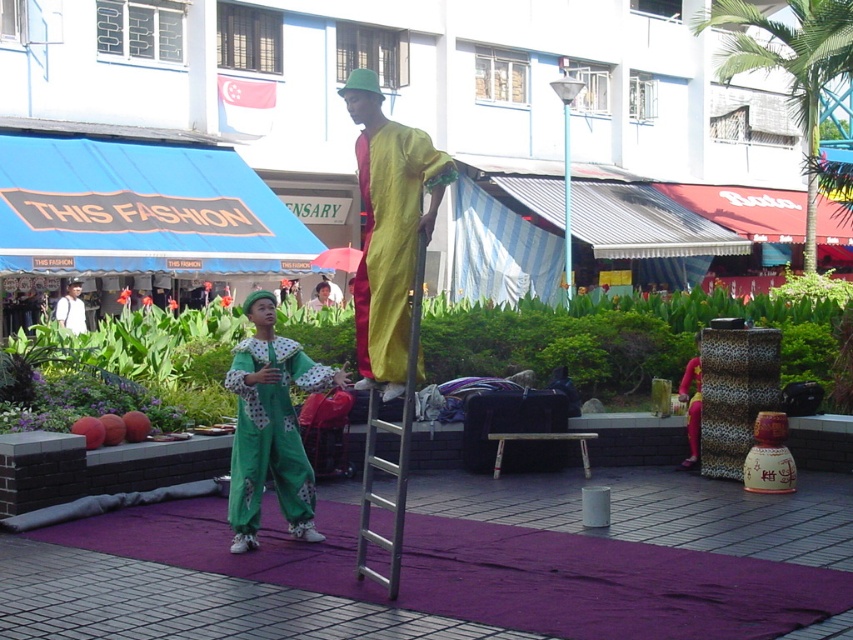
You are a photographer trying to capture the performers on the purple carpet. You notice two points marked in the scene. Which point, point (358, 257) or point (329, 305), is closer to your camera lens?

Point (358, 257) is closer to the viewer than point (329, 305), so the photographer should focus on point (358, 257) to capture it more clearly.

You are a street performer who wants to place a new prop between the metallic silver ladder at center and the pink leopard print robe at center. Given that the prop requires 1 meter of space, can you fit it there?

The metallic silver ladder at center is larger than the pink leopard print robe at center, but the description does not provide exact measurements of the space between them. Therefore, it is uncertain if the prop requiring 1 meter of space can fit there.

You are a photographer trying to capture the entire scene of the street performance. You notice the pink leopard print robe at center and the green fabric clown at center. Which object is closer to the camera based on their positions?

The pink leopard print robe at center is positioned under the green fabric clown at center, so the green fabric clown at center is closer to the camera.